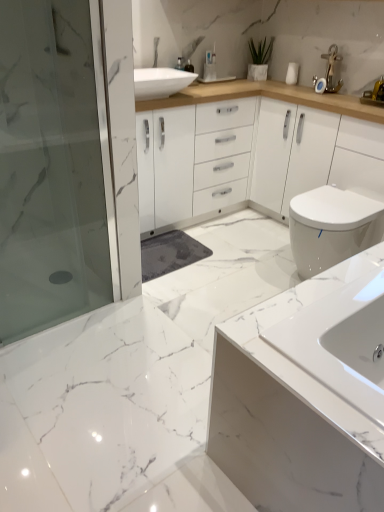
Where is `free space in front of transparent glass shower door at left`? The height and width of the screenshot is (512, 384). free space in front of transparent glass shower door at left is located at coordinates (62, 362).